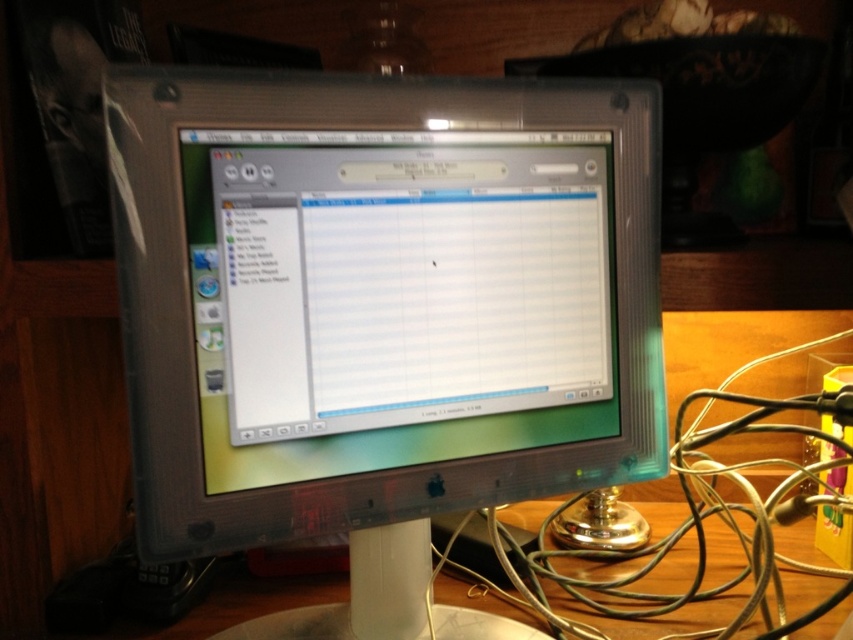
Question: Can you confirm if clear plastic monitor at center is smaller than green metallic wire at right?

Choices:
 (A) no
 (B) yes

Answer: (B)

Question: Is clear plastic monitor at center closer to camera compared to green metallic wire at right?

Choices:
 (A) no
 (B) yes

Answer: (B)

Question: Among these objects, which one is farthest from the camera?

Choices:
 (A) green metallic wire at right
 (B) clear plastic monitor at center

Answer: (A)

Question: Can you confirm if clear plastic monitor at center is positioned below green metallic wire at right?

Choices:
 (A) no
 (B) yes

Answer: (A)

Question: Which point appears closest to the camera in this image?

Choices:
 (A) (498, 554)
 (B) (173, 120)

Answer: (B)